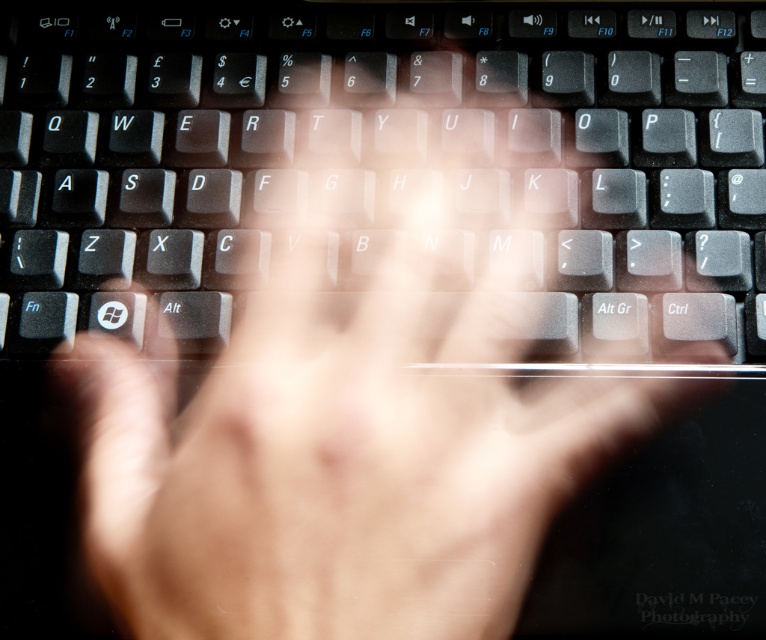
Question: Does black matte keyboard at center have a greater width compared to translucent skin at center?

Choices:
 (A) no
 (B) yes

Answer: (B)

Question: Is black matte keyboard at center closer to camera compared to translucent skin at center?

Choices:
 (A) yes
 (B) no

Answer: (B)

Question: Does black matte keyboard at center have a lesser width compared to translucent skin at center?

Choices:
 (A) no
 (B) yes

Answer: (A)

Question: Which point is farther to the camera?

Choices:
 (A) (159, 580)
 (B) (128, 189)

Answer: (B)